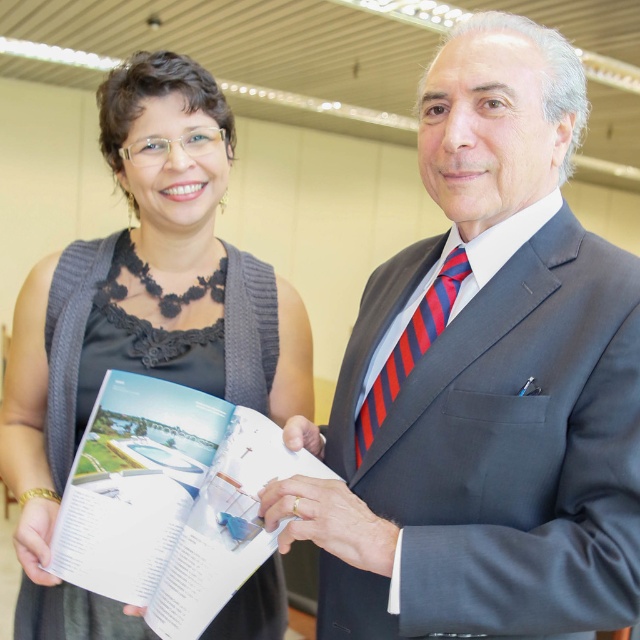
Between matte gray suit at center and black knitted sweater at left, which one is positioned lower?

matte gray suit at center is lower down.

How far apart are matte gray suit at center and black knitted sweater at left?

The distance of matte gray suit at center from black knitted sweater at left is 19.14 inches.

Locate an element on the screen. The image size is (640, 640). matte gray suit at center is located at coordinates (483, 381).

Image resolution: width=640 pixels, height=640 pixels. In order to click on matte gray suit at center in this screenshot , I will do `click(483, 381)`.

Is the position of matte gray suit at center less distant than that of red striped tie at center?

Yes, it is.

The width and height of the screenshot is (640, 640). Find the location of `matte gray suit at center`. matte gray suit at center is located at coordinates click(x=483, y=381).

Locate an element on the screen. matte gray suit at center is located at coordinates (483, 381).

Describe the element at coordinates (140, 316) in the screenshot. I see `black knitted sweater at left` at that location.

Can you confirm if black knitted sweater at left is thinner than white paper book at center?

No.

Is point (209, 356) in front of point (205, 468)?

No, it is behind (205, 468).

What are the coordinates of `black knitted sweater at left` in the screenshot? It's located at pos(140,316).